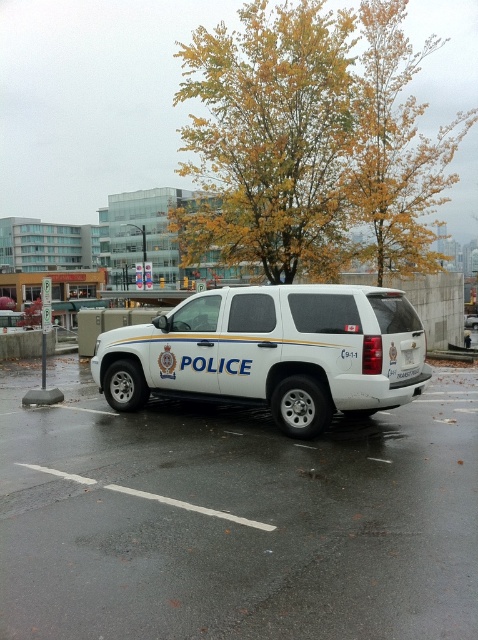
Which is behind, point (234, 618) or point (239, 333)?

The point (239, 333) is behind.

Can you confirm if white glossy police car at center is positioned above white matte police suv at center?

Actually, white glossy police car at center is below white matte police suv at center.

Where is `white glossy police car at center`? white glossy police car at center is located at coordinates (236, 518).

Is yellow leaves at upper center positioned in front of white plastic license plate at rear?

No, yellow leaves at upper center is further to the viewer.

This screenshot has height=640, width=478. I want to click on yellow leaves at upper center, so click(x=398, y=147).

Is point (419, 192) farther from camera compared to point (390, 374)?

Yes, point (419, 192) is farther from viewer.

I want to click on yellow leaves at upper center, so click(x=398, y=147).

Is white matte police suv at center wider than white plastic license plate at rear?

Correct, the width of white matte police suv at center exceeds that of white plastic license plate at rear.

Which is more to the left, white matte police suv at center or white plastic license plate at rear?

Positioned to the left is white matte police suv at center.

The width and height of the screenshot is (478, 640). What are the coordinates of `white matte police suv at center` in the screenshot? It's located at (271, 353).